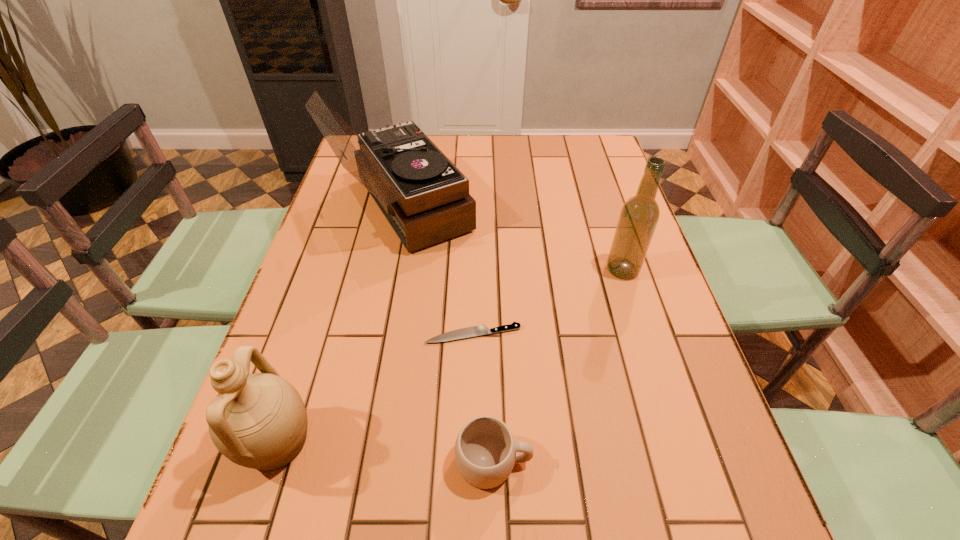
I want to click on vacant space located 0.280m on the back of the shortest object, so click(x=474, y=242).

You are a GUI agent. You are given a task and a screenshot of the screen. Output one action in this format:
    pyautogui.click(x=<x>, y=<y>)
    Task: Click on the object that is at the far edge
    
    Given the screenshot: What is the action you would take?
    click(425, 198)

Image resolution: width=960 pixels, height=540 pixels. What are the coordinates of `record player that is positioned at the left edge` in the screenshot? It's located at (425, 198).

In order to click on pitcher at the left edge in this screenshot , I will do `click(259, 421)`.

This screenshot has height=540, width=960. I want to click on object that is positioned at the right edge, so click(x=639, y=216).

Where is `object present at the far left corner`? The height and width of the screenshot is (540, 960). object present at the far left corner is located at coordinates (425, 198).

Identify the location of free space at the far edge. The image size is (960, 540). (x=453, y=157).

In order to click on free region at the near edge of the desktop in this screenshot , I will do `click(601, 534)`.

Identify the location of vacant space at the left edge of the desktop. Image resolution: width=960 pixels, height=540 pixels. (304, 306).

Image resolution: width=960 pixels, height=540 pixels. In the image, there is a desktop. Identify the location of free space at the right edge. (666, 299).